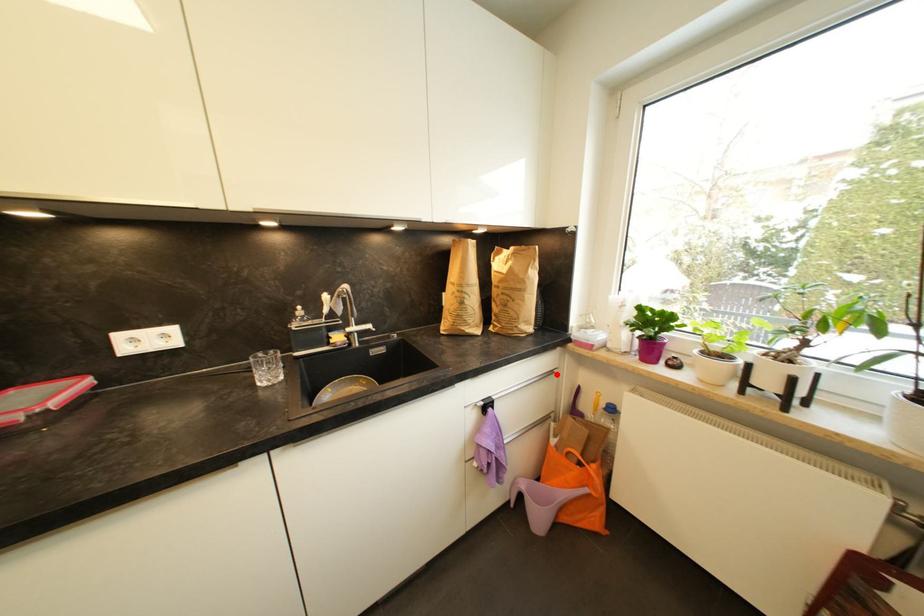
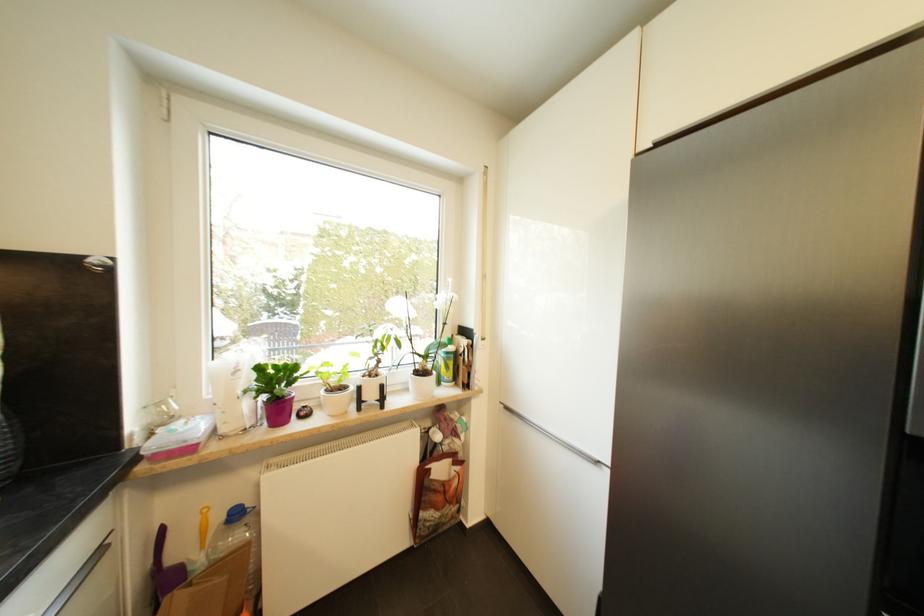
Find the pixel in the second image that matches the highlighted location in the first image.

(105, 553)